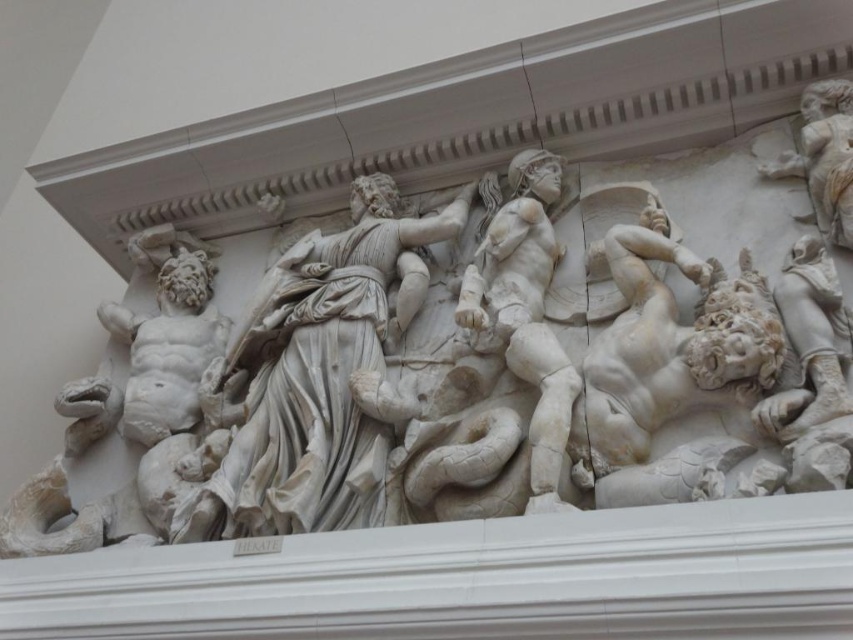
Between white marble warrior at center and white marble warrior at upper right, which one is positioned higher?

white marble warrior at upper right

Find the location of `white marble warrior at center`. white marble warrior at center is located at coordinates (525, 312).

Locate an element on the screen. white marble warrior at center is located at coordinates click(x=525, y=312).

Does white marble sculpture at center appear on the left side of white marble figure at left?

Incorrect, white marble sculpture at center is not on the left side of white marble figure at left.

Can you confirm if white marble sculpture at center is positioned to the right of white marble figure at left?

Yes, white marble sculpture at center is to the right of white marble figure at left.

Which is behind, point (405, 442) or point (193, 339)?

Point (193, 339)

The image size is (853, 640). What are the coordinates of `white marble sculpture at center` in the screenshot? It's located at (466, 358).

Who is taller, white marble figure at right or white marble figure at left?

Standing taller between the two is white marble figure at right.

Can you confirm if white marble figure at right is taller than white marble figure at left?

Indeed, white marble figure at right has a greater height compared to white marble figure at left.

Is point (663, 224) closer to camera compared to point (183, 385)?

Yes.

At what (x,y) coordinates should I click in order to perform the action: click on white marble figure at right. Please return your answer as a coordinate pair (x, y). The image size is (853, 640). Looking at the image, I should click on click(x=669, y=369).